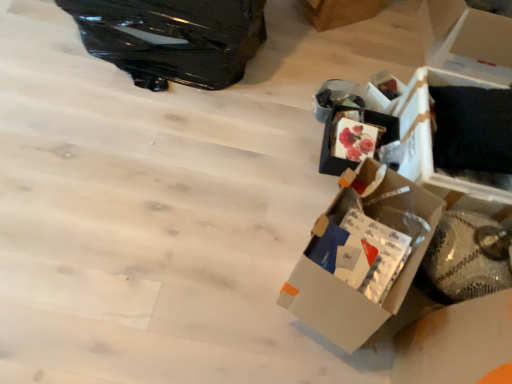
Find the location of a particular element. vacant space in between glossy black suitcase at upper left and white cardboard box at upper right, arranged as the 1th storage box when viewed from the back is located at coordinates (289, 71).